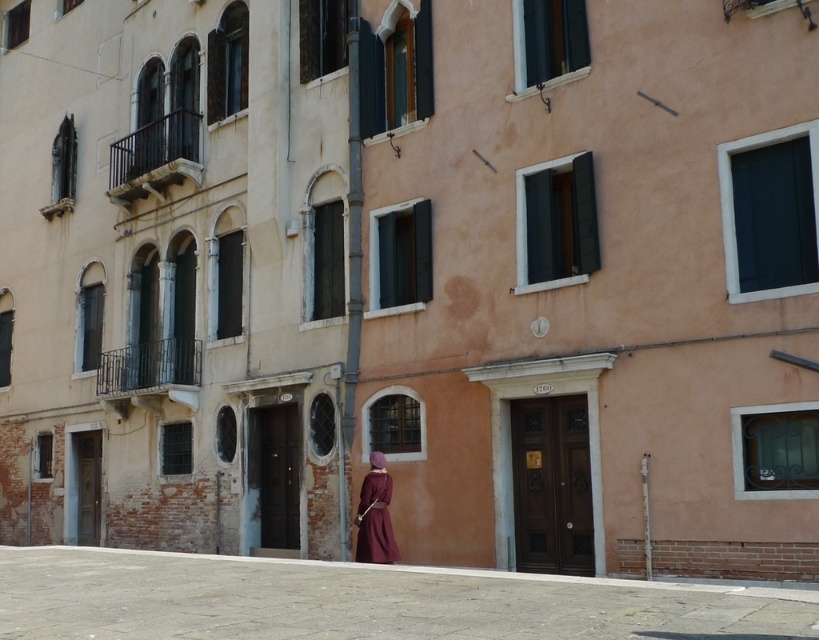
Question: Which of the following is the farthest from the observer?

Choices:
 (A) velvet maroon dress at center
 (B) smooth concrete ground at lower center

Answer: (A)

Question: Does smooth concrete ground at lower center lie behind velvet maroon dress at center?

Choices:
 (A) no
 (B) yes

Answer: (A)

Question: Which point appears closest to the camera in this image?

Choices:
 (A) (35, 561)
 (B) (383, 534)

Answer: (B)

Question: Does smooth concrete ground at lower center have a lesser width compared to velvet maroon dress at center?

Choices:
 (A) yes
 (B) no

Answer: (B)

Question: Does smooth concrete ground at lower center appear on the left side of velvet maroon dress at center?

Choices:
 (A) yes
 (B) no

Answer: (A)

Question: Which of the following is the farthest from the observer?

Choices:
 (A) (202, 608)
 (B) (385, 518)

Answer: (B)